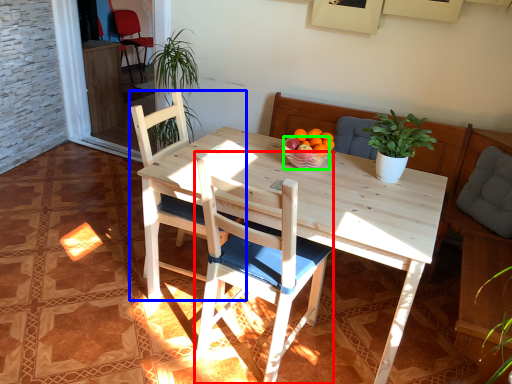
Question: Based on their relative distances, which object is farther from chair (highlighted by a red box)? Choose from chair (highlighted by a blue box) and bowl (highlighted by a green box).

Choices:
 (A) chair
 (B) bowl

Answer: (B)